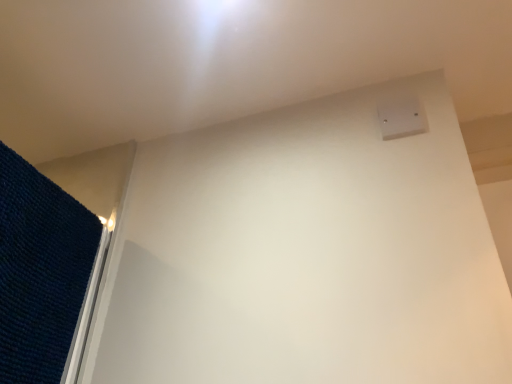
Question: Considering the positions of dark blue textured mat at left and white plastic electric outlet at upper right in the image, is dark blue textured mat at left bigger or smaller than white plastic electric outlet at upper right?

Choices:
 (A) small
 (B) big

Answer: (B)

Question: Considering their positions, is dark blue textured mat at left located in front of or behind white plastic electric outlet at upper right?

Choices:
 (A) behind
 (B) front

Answer: (B)

Question: Considering the positions of point (73, 307) and point (417, 132), is point (73, 307) closer or farther from the camera than point (417, 132)?

Choices:
 (A) farther
 (B) closer

Answer: (B)

Question: From a real-world perspective, is white plastic electric outlet at upper right positioned above or below dark blue textured mat at left?

Choices:
 (A) below
 (B) above

Answer: (B)

Question: Considering the positions of white plastic electric outlet at upper right and dark blue textured mat at left in the image, is white plastic electric outlet at upper right bigger or smaller than dark blue textured mat at left?

Choices:
 (A) big
 (B) small

Answer: (B)

Question: Is white plastic electric outlet at upper right wider or thinner than dark blue textured mat at left?

Choices:
 (A) wide
 (B) thin

Answer: (B)

Question: In the image, is white plastic electric outlet at upper right on the left side or the right side of dark blue textured mat at left?

Choices:
 (A) right
 (B) left

Answer: (A)